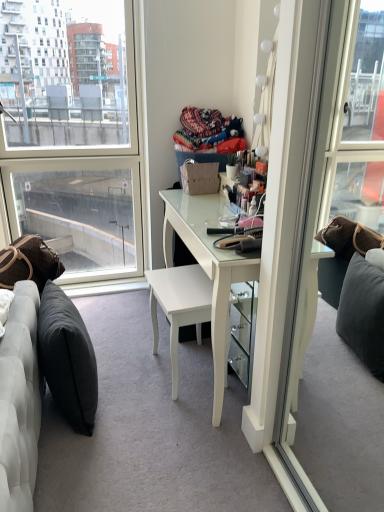
Question: Is brown leather pillow at lower left, which is counted as the 1th pillow, starting from the left, taller than transparent glass window at left?

Choices:
 (A) no
 (B) yes

Answer: (A)

Question: Is brown leather pillow at lower left, arranged as the second pillow when viewed from the right, touching transparent glass window at left?

Choices:
 (A) no
 (B) yes

Answer: (A)

Question: Could you tell me if brown leather pillow at lower left, arranged as the second pillow when viewed from the right, is turned towards transparent glass window at left?

Choices:
 (A) yes
 (B) no

Answer: (B)

Question: Could transparent glass window at left be considered to be inside brown leather pillow at lower left, arranged as the second pillow when viewed from the right?

Choices:
 (A) yes
 (B) no

Answer: (B)

Question: Is brown leather pillow at lower left, arranged as the second pillow when viewed from the right, shorter than transparent glass window at left?

Choices:
 (A) yes
 (B) no

Answer: (A)

Question: From the image's perspective, is brown leather pillow at lower left, which is counted as the 1th pillow, starting from the left, over transparent glass window at left?

Choices:
 (A) yes
 (B) no

Answer: (B)

Question: Can you confirm if dark gray fabric pillow at lower left, arranged as the 1th pillow when viewed from the right, is taller than white glossy chair at center?

Choices:
 (A) yes
 (B) no

Answer: (A)

Question: From the image's perspective, does dark gray fabric pillow at lower left, the second pillow viewed from the left, appear higher than white glossy chair at center?

Choices:
 (A) yes
 (B) no

Answer: (B)

Question: Does dark gray fabric pillow at lower left, the second pillow viewed from the left, lie in front of white glossy chair at center?

Choices:
 (A) no
 (B) yes

Answer: (B)

Question: Considering the relative sizes of dark gray fabric pillow at lower left, the second pillow viewed from the left, and white glossy chair at center in the image provided, is dark gray fabric pillow at lower left, the second pillow viewed from the left, smaller than white glossy chair at center?

Choices:
 (A) yes
 (B) no

Answer: (B)

Question: Can you confirm if dark gray fabric pillow at lower left, arranged as the 1th pillow when viewed from the right, is thinner than white glossy chair at center?

Choices:
 (A) no
 (B) yes

Answer: (B)

Question: Would you say white glossy chair at center is part of dark gray fabric pillow at lower left, the second pillow viewed from the left,'s contents?

Choices:
 (A) no
 (B) yes

Answer: (A)

Question: Considering the relative sizes of white glossy desk at center and white glossy chair at center in the image provided, is white glossy desk at center bigger than white glossy chair at center?

Choices:
 (A) yes
 (B) no

Answer: (A)